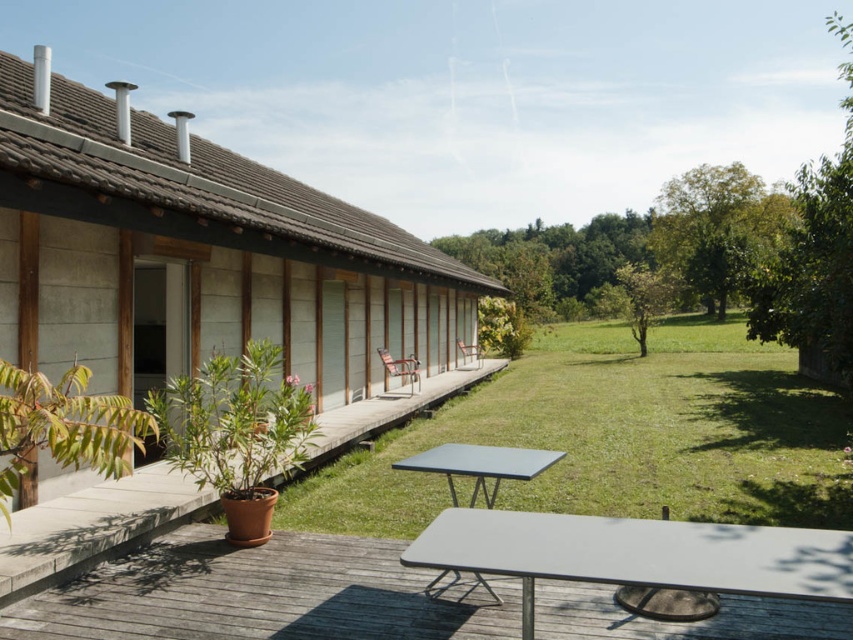
Is matte concrete terrace at left bigger than smooth gray table at lower center?

Indeed, matte concrete terrace at left has a larger size compared to smooth gray table at lower center.

Which is below, matte concrete terrace at left or smooth gray table at lower center?

smooth gray table at lower center

Is point (10, 104) farther from camera compared to point (222, 554)?

Yes, point (10, 104) is farther from viewer.

The height and width of the screenshot is (640, 853). Find the location of `matte concrete terrace at left`. matte concrete terrace at left is located at coordinates (196, 253).

How distant is matte concrete terrace at left from brown wooden deck at lower left?

matte concrete terrace at left and brown wooden deck at lower left are 3.71 meters apart.

Describe the element at coordinates (196, 253) in the screenshot. Image resolution: width=853 pixels, height=640 pixels. I see `matte concrete terrace at left` at that location.

Image resolution: width=853 pixels, height=640 pixels. Find the location of `matte concrete terrace at left`. matte concrete terrace at left is located at coordinates (196, 253).

Is smooth gray table at lower center wider than brown wooden deck at lower left?

Correct, the width of smooth gray table at lower center exceeds that of brown wooden deck at lower left.

Which is behind, point (219, 602) or point (99, 554)?

The point (99, 554) is behind.

Locate an element on the screen. smooth gray table at lower center is located at coordinates (265, 595).